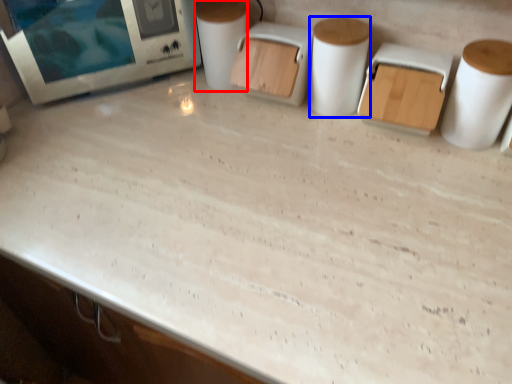
Question: Which of the following is the closest to the observer, toilet paper (highlighted by a red box) or paper towel (highlighted by a blue box)?

Choices:
 (A) toilet paper
 (B) paper towel

Answer: (B)